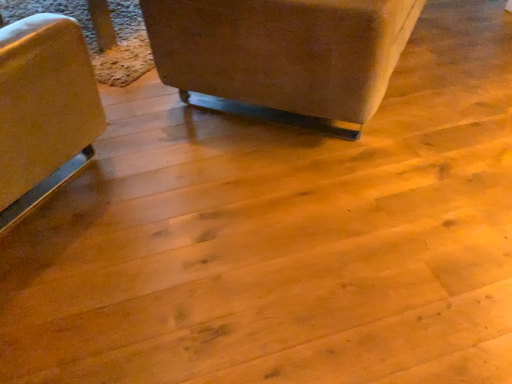
Where is `suede-like brown couch at upper center`? The height and width of the screenshot is (384, 512). suede-like brown couch at upper center is located at coordinates (282, 56).

What do you see at coordinates (282, 56) in the screenshot?
I see `suede-like brown couch at upper center` at bounding box center [282, 56].

What is the approximate width of suede-like brown couch at upper center?

It is 3.73 feet.

Where is `suede-like brown couch at upper center`? suede-like brown couch at upper center is located at coordinates 282,56.